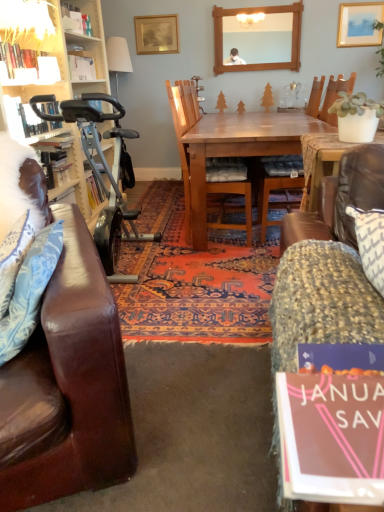
Question: From a real-world perspective, is wooden picture frame at upper center, acting as the first picture frame starting from the back, physically below blue floral fabric pillow at left?

Choices:
 (A) yes
 (B) no

Answer: (B)

Question: Is the position of wooden picture frame at upper center, placed as the second picture frame when sorted from right to left, more distant than that of blue floral fabric pillow at left?

Choices:
 (A) no
 (B) yes

Answer: (B)

Question: Is wooden picture frame at upper center, marked as the second picture frame in a front-to-back arrangement, oriented towards blue floral fabric pillow at left?

Choices:
 (A) yes
 (B) no

Answer: (A)

Question: Does wooden picture frame at upper center, the first picture frame when ordered from left to right, have a greater height compared to blue floral fabric pillow at left?

Choices:
 (A) yes
 (B) no

Answer: (B)

Question: Is wooden picture frame at upper center, placed as the second picture frame when sorted from right to left, closer to camera compared to blue floral fabric pillow at left?

Choices:
 (A) yes
 (B) no

Answer: (B)

Question: Can you confirm if wooden picture frame at upper center, the first picture frame when ordered from left to right, is positioned to the right of blue floral fabric pillow at left?

Choices:
 (A) yes
 (B) no

Answer: (A)

Question: From the image's perspective, is wooden chair at center, arranged as the 1th chair when viewed from the right, over matte white lampshade at upper left?

Choices:
 (A) yes
 (B) no

Answer: (B)

Question: From a real-world perspective, is wooden chair at center, the second chair positioned from the left, under matte white lampshade at upper left?

Choices:
 (A) no
 (B) yes

Answer: (B)

Question: Is wooden chair at center, arranged as the 1th chair when viewed from the right, shorter than matte white lampshade at upper left?

Choices:
 (A) no
 (B) yes

Answer: (A)

Question: Considering the relative sizes of wooden chair at center, arranged as the 1th chair when viewed from the right, and matte white lampshade at upper left in the image provided, is wooden chair at center, arranged as the 1th chair when viewed from the right, thinner than matte white lampshade at upper left?

Choices:
 (A) yes
 (B) no

Answer: (B)

Question: Is wooden chair at center, arranged as the 1th chair when viewed from the right, oriented away from matte white lampshade at upper left?

Choices:
 (A) yes
 (B) no

Answer: (B)

Question: Could you tell me if wooden chair at center, the second chair positioned from the left, is facing matte white lampshade at upper left?

Choices:
 (A) yes
 (B) no

Answer: (B)

Question: Is blue floral fabric pillow at left closer to the viewer compared to white feathered pillow at left?

Choices:
 (A) yes
 (B) no

Answer: (A)